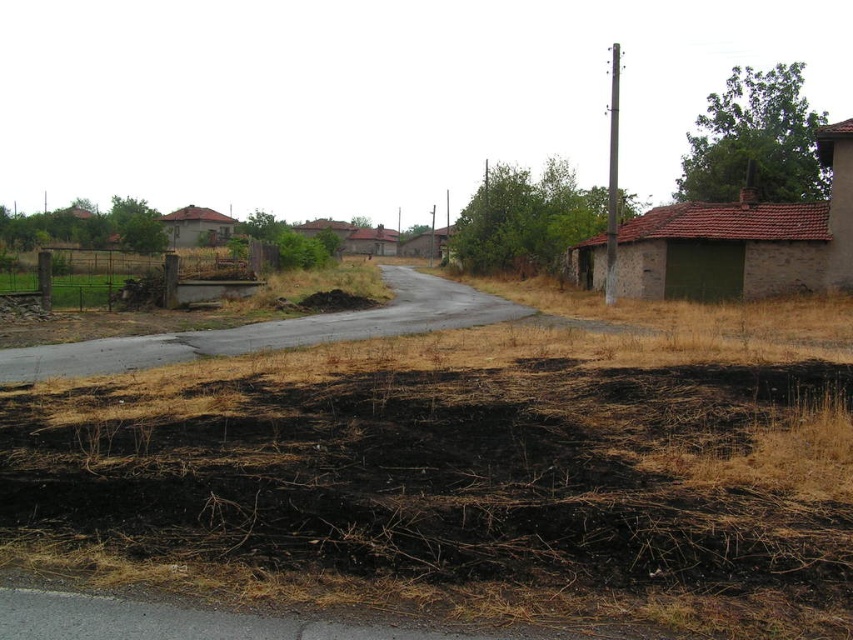
Looking at this image, who is higher up, burnt dry grass at lower center or brown dry grass at left?

brown dry grass at left is above.

Which of these two, burnt dry grass at lower center or brown dry grass at left, stands taller?

Standing taller between the two is brown dry grass at left.

Is point (834, 372) more distant than point (42, 282)?

No, (834, 372) is in front of (42, 282).

Identify the location of burnt dry grass at lower center. (445, 474).